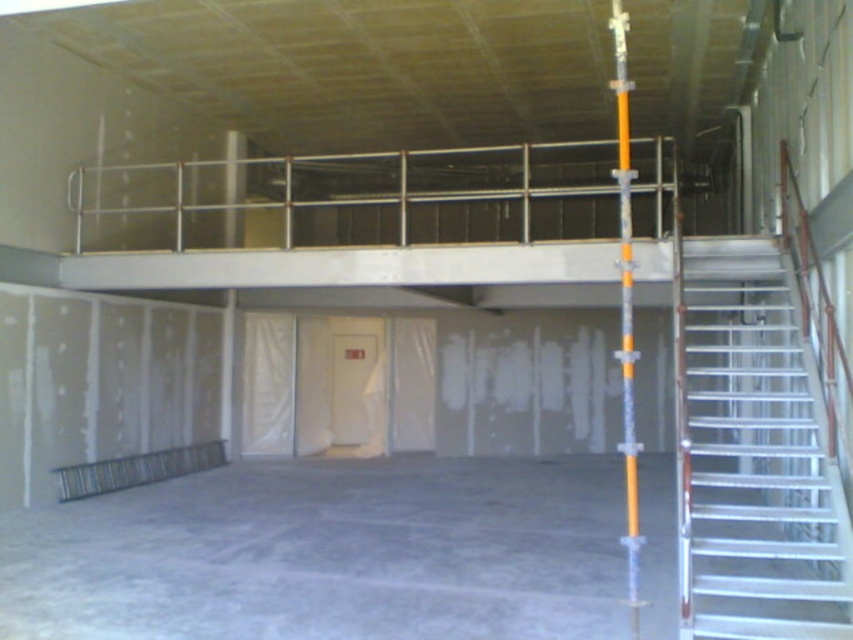
You are a GUI agent. You are given a task and a screenshot of the screen. Output one action in this format:
    pyautogui.click(x=<x>, y=<y>)
    Task: Click on the orange metallic pole at right
    Image resolution: width=853 pixels, height=640 pixels.
    Given the screenshot: What is the action you would take?
    pyautogui.click(x=625, y=307)

Can you confirm if orange metallic pole at right is thinner than metallic silver balustrade at lower left?

Incorrect, orange metallic pole at right's width is not less than metallic silver balustrade at lower left's.

Locate an element on the screen. This screenshot has height=640, width=853. orange metallic pole at right is located at coordinates (625, 307).

What are the coordinates of `orange metallic pole at right` in the screenshot? It's located at pos(625,307).

Can you confirm if metallic silver staircase at right is wider than metallic silver balustrade at lower left?

Yes, metallic silver staircase at right is wider than metallic silver balustrade at lower left.

Find the location of `metallic silver staircase at right`. metallic silver staircase at right is located at coordinates (751, 456).

What do you see at coordinates (751, 456) in the screenshot?
I see `metallic silver staircase at right` at bounding box center [751, 456].

Find the location of a particular element. The width and height of the screenshot is (853, 640). metallic silver staircase at right is located at coordinates (751, 456).

Who is taller, metallic silver staircase at right or orange metallic pole at right?

With more height is orange metallic pole at right.

In the scene shown: Which is above, metallic silver staircase at right or orange metallic pole at right?

orange metallic pole at right is above.

The height and width of the screenshot is (640, 853). What are the coordinates of `metallic silver staircase at right` in the screenshot? It's located at (751, 456).